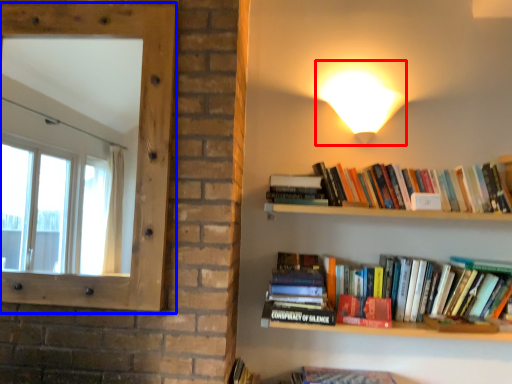
Question: Which object is further to the camera taking this photo, light (highlighted by a red box) or window screen (highlighted by a blue box)?

Choices:
 (A) light
 (B) window screen

Answer: (A)